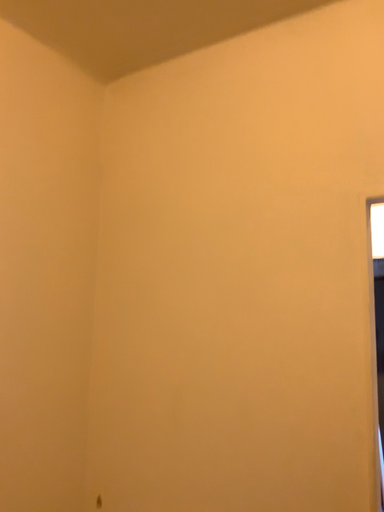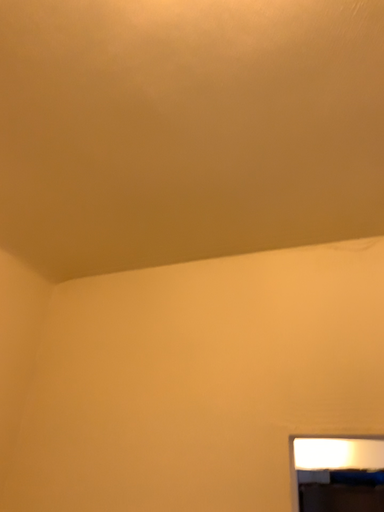
Question: Which way did the camera rotate in the video?

Choices:
 (A) rotated right
 (B) rotated left

Answer: (A)